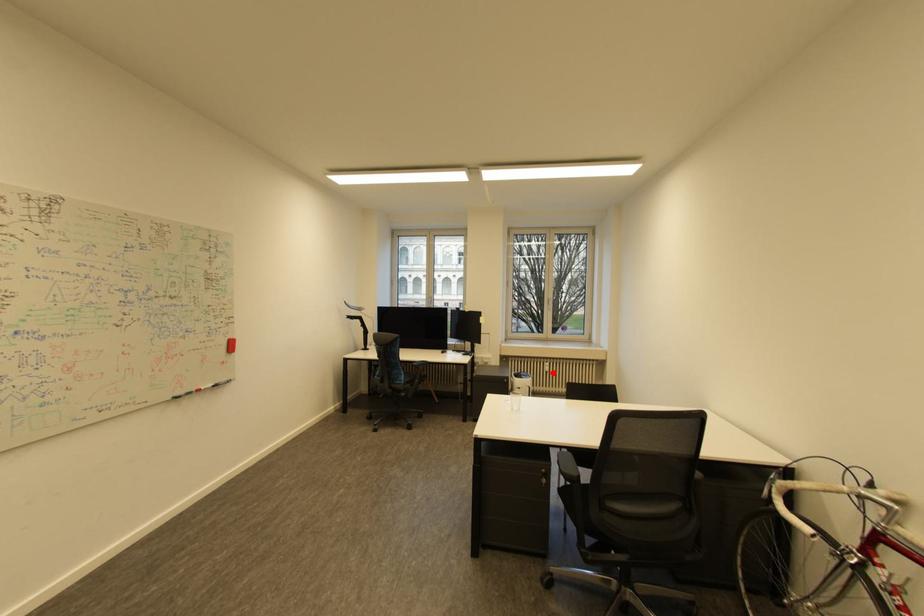
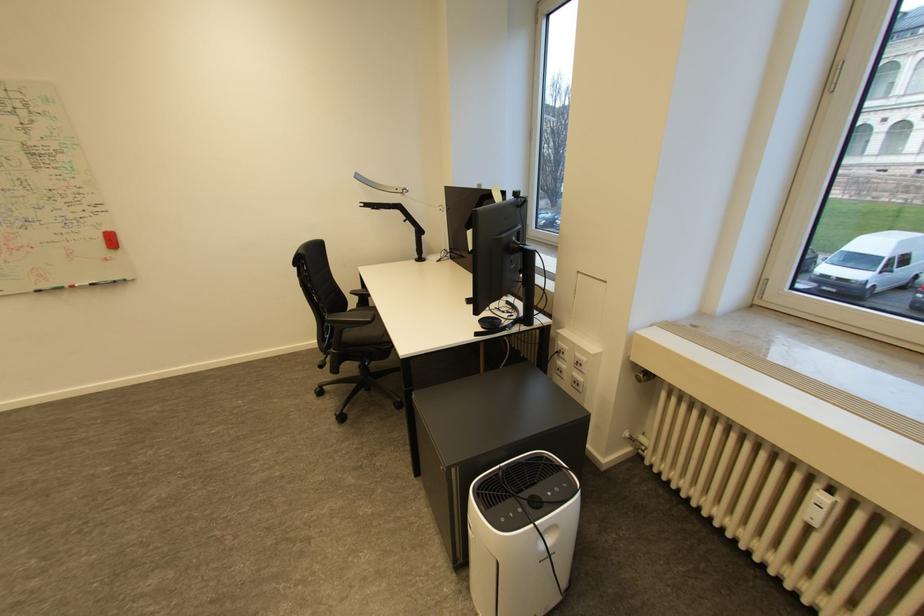
Question: I am providing you with two images of the same scene from different viewpoints. A red point is shown in image1. For the corresponding object point in image2, is it positioned nearer or farther from the camera?

Choices:
 (A) Nearer
 (B) Farther

Answer: (A)